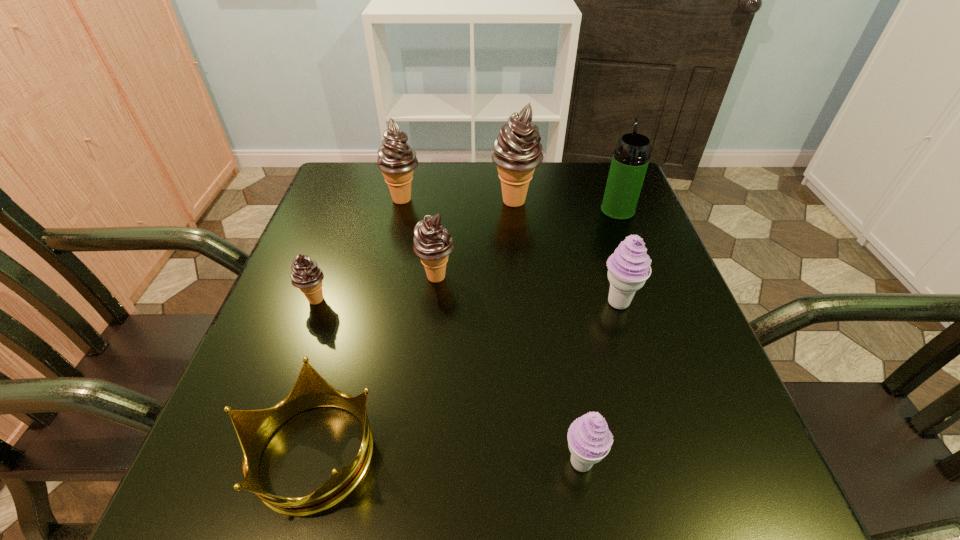
Identify the location of free space located 0.270m on the front of the second chocolate icecream from right to left. (423, 411).

The image size is (960, 540). What are the coordinates of `vacant region located 0.120m on the left of the right purple icecream` in the screenshot? It's located at (537, 302).

Where is `vacant region located 0.130m on the right of the nearest icecream`? The height and width of the screenshot is (540, 960). vacant region located 0.130m on the right of the nearest icecream is located at coordinates (690, 461).

Where is `free region located 0.360m on the front of the smallest chocolate icecream`? This screenshot has width=960, height=540. free region located 0.360m on the front of the smallest chocolate icecream is located at coordinates (239, 510).

Find the location of a particular element. The height and width of the screenshot is (540, 960). vacant space located 0.350m on the back of the crown is located at coordinates (368, 255).

Find the location of `thermos bottle at the far edge`. thermos bottle at the far edge is located at coordinates (630, 160).

The width and height of the screenshot is (960, 540). Identify the location of icecream at the near edge. (589, 439).

At what (x,y) coordinates should I click in order to perform the action: click on crown that is at the near edge. Please return your answer as a coordinate pair (x, y). This screenshot has height=540, width=960. Looking at the image, I should click on [x=254, y=428].

I want to click on crown positioned at the left edge, so click(x=254, y=428).

Where is `thermos bottle that is at the right edge`? Image resolution: width=960 pixels, height=540 pixels. thermos bottle that is at the right edge is located at coordinates [630, 160].